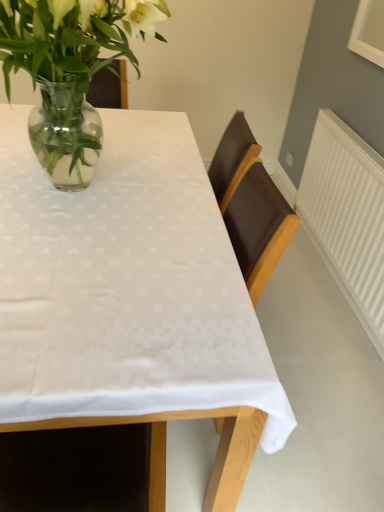
Question: Does white fabric table at center appear on the right side of clear glass vase at upper left?

Choices:
 (A) yes
 (B) no

Answer: (B)

Question: From a real-world perspective, does white fabric table at center stand above clear glass vase at upper left?

Choices:
 (A) no
 (B) yes

Answer: (A)

Question: Can you confirm if white fabric table at center is thinner than clear glass vase at upper left?

Choices:
 (A) no
 (B) yes

Answer: (A)

Question: From a real-world perspective, is white fabric table at center located beneath clear glass vase at upper left?

Choices:
 (A) yes
 (B) no

Answer: (A)

Question: From the image's perspective, is white fabric table at center below clear glass vase at upper left?

Choices:
 (A) yes
 (B) no

Answer: (A)

Question: Can you confirm if white fabric table at center is shorter than clear glass vase at upper left?

Choices:
 (A) no
 (B) yes

Answer: (A)

Question: From the image's perspective, is clear glass vase at upper left beneath white fabric table at center?

Choices:
 (A) yes
 (B) no

Answer: (B)

Question: Is clear glass vase at upper left oriented away from white fabric table at center?

Choices:
 (A) no
 (B) yes

Answer: (A)

Question: Is clear glass vase at upper left at the right side of white fabric table at center?

Choices:
 (A) yes
 (B) no

Answer: (A)

Question: From a real-world perspective, is clear glass vase at upper left located higher than white fabric table at center?

Choices:
 (A) yes
 (B) no

Answer: (A)

Question: Is clear glass vase at upper left aimed at white fabric table at center?

Choices:
 (A) yes
 (B) no

Answer: (B)

Question: Does clear glass vase at upper left contain white fabric table at center?

Choices:
 (A) yes
 (B) no

Answer: (B)

Question: In the image, is clear glass vase at upper left on the left side or the right side of white fabric table at center?

Choices:
 (A) left
 (B) right

Answer: (B)